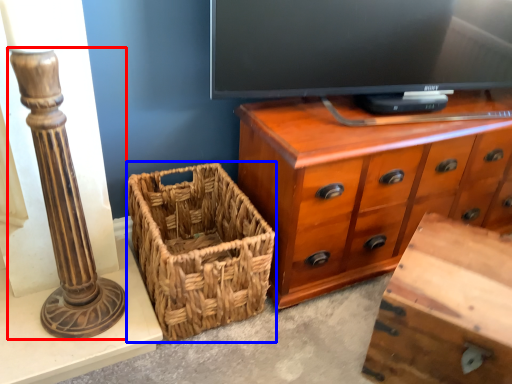
Question: Which of the following is the farthest to the observer, pillar (highlighted by a red box) or picnic basket (highlighted by a blue box)?

Choices:
 (A) pillar
 (B) picnic basket

Answer: (B)